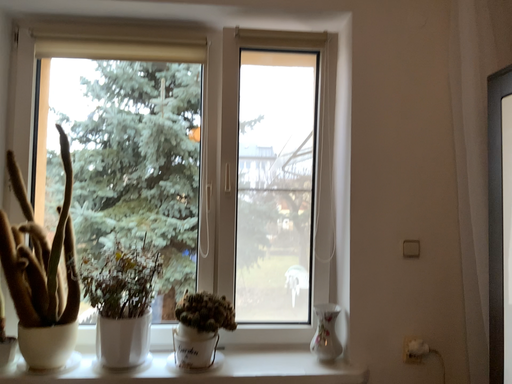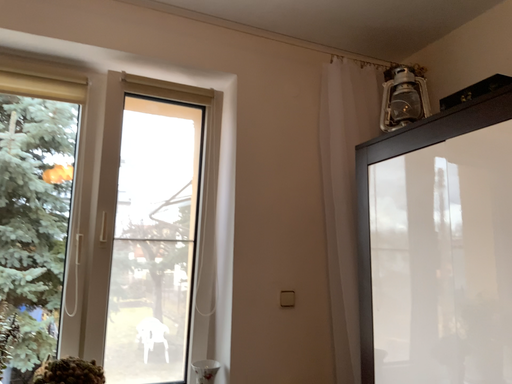
Question: How did the camera likely rotate when shooting the video?

Choices:
 (A) rotated left
 (B) rotated right

Answer: (B)